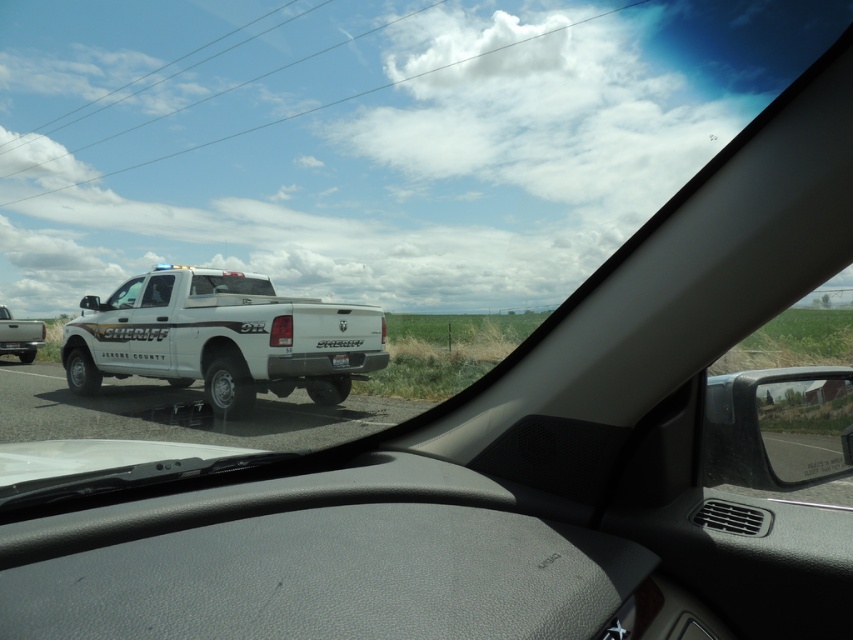
Which is below, white matte pickup truck at left or clear glass windshield at center?

white matte pickup truck at left is lower down.

Does white matte pickup truck at left appear over clear glass windshield at center?

No.

Between point (0, 314) and point (252, 285), which one is positioned behind?

Positioned behind is point (0, 314).

The width and height of the screenshot is (853, 640). What are the coordinates of `white matte pickup truck at left` in the screenshot? It's located at (19, 336).

Is white matte sheriff truck at center thinner than clear glass windshield at center?

Yes, white matte sheriff truck at center is thinner than clear glass windshield at center.

In the scene shown: Is white matte sheriff truck at center closer to the viewer compared to clear glass windshield at center?

Yes, it is.

Where is `white matte sheriff truck at center`? This screenshot has height=640, width=853. white matte sheriff truck at center is located at coordinates (221, 340).

Where is `white matte sheriff truck at center`? The height and width of the screenshot is (640, 853). white matte sheriff truck at center is located at coordinates (221, 340).

Does point (102, 369) come closer to viewer compared to point (332, 362)?

No, it is behind (332, 362).

Does white matte sheriff truck at center appear on the left side of white matte license plate at center?

Correct, you'll find white matte sheriff truck at center to the left of white matte license plate at center.

Who is more forward, [235,317] or [338,355]?

Point [235,317] is more forward.

At what (x,y) coordinates should I click in order to perform the action: click on white matte sheriff truck at center. Please return your answer as a coordinate pair (x, y). The image size is (853, 640). Looking at the image, I should click on (221, 340).